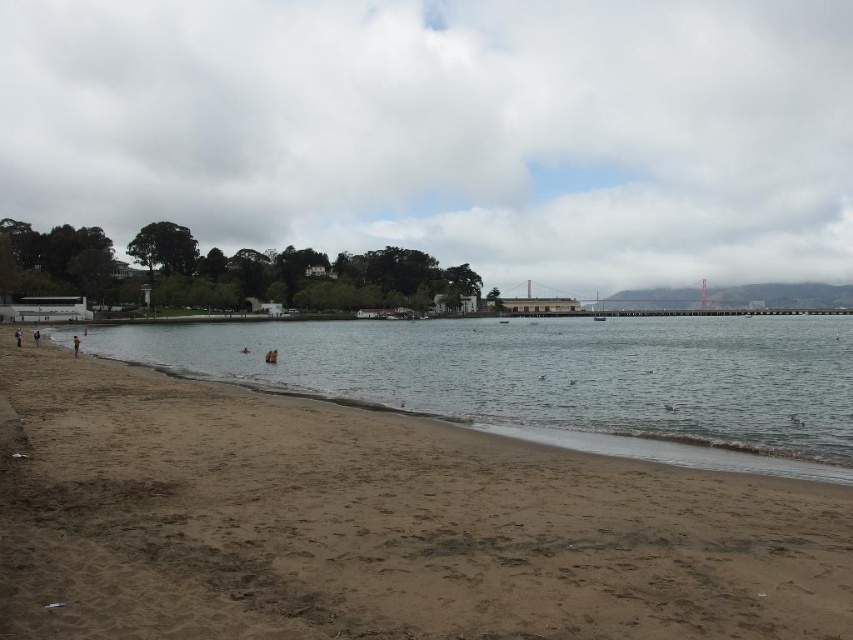
Question: Which of the following is the farthest from the observer?

Choices:
 (A) clear water at beach left
 (B) brown sand at lower left

Answer: (A)

Question: Which point is farther to the camera?

Choices:
 (A) cloudy sky at upper center
 (B) brown sand at lower left
 (C) clear water at beach left

Answer: (A)

Question: Can you confirm if cloudy sky at upper center is positioned to the right of clear water at beach left?

Choices:
 (A) yes
 (B) no

Answer: (A)

Question: Estimate the real-world distances between objects in this image. Which object is farther from the clear water at beach left?

Choices:
 (A) cloudy sky at upper center
 (B) brown sand at lower left

Answer: (A)

Question: Is brown sand at lower left bigger than clear water at beach left?

Choices:
 (A) no
 (B) yes

Answer: (A)

Question: Is cloudy sky at upper center in front of brown sand at lower left?

Choices:
 (A) no
 (B) yes

Answer: (A)